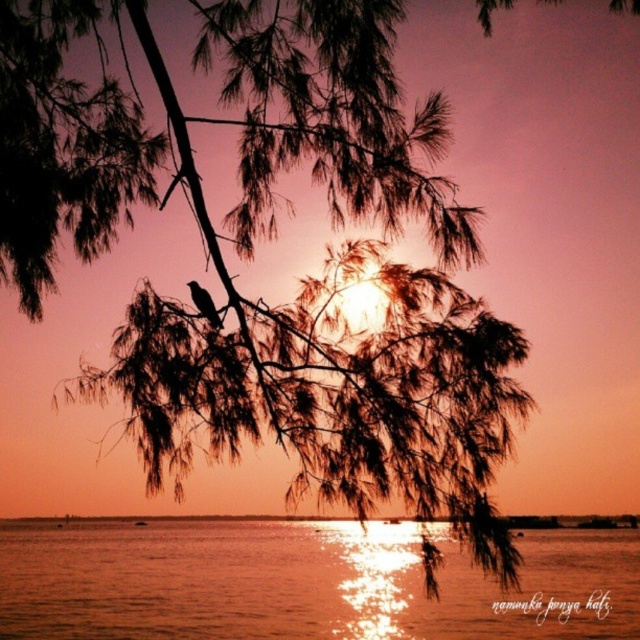
Is shiny reflective water at center positioned at the back of brown feathered bird at upper left?

No, it is in front of brown feathered bird at upper left.

Can you confirm if shiny reflective water at center is positioned below brown feathered bird at upper left?

Yes.

Where is `shiny reflective water at center`? The width and height of the screenshot is (640, 640). shiny reflective water at center is located at coordinates (305, 584).